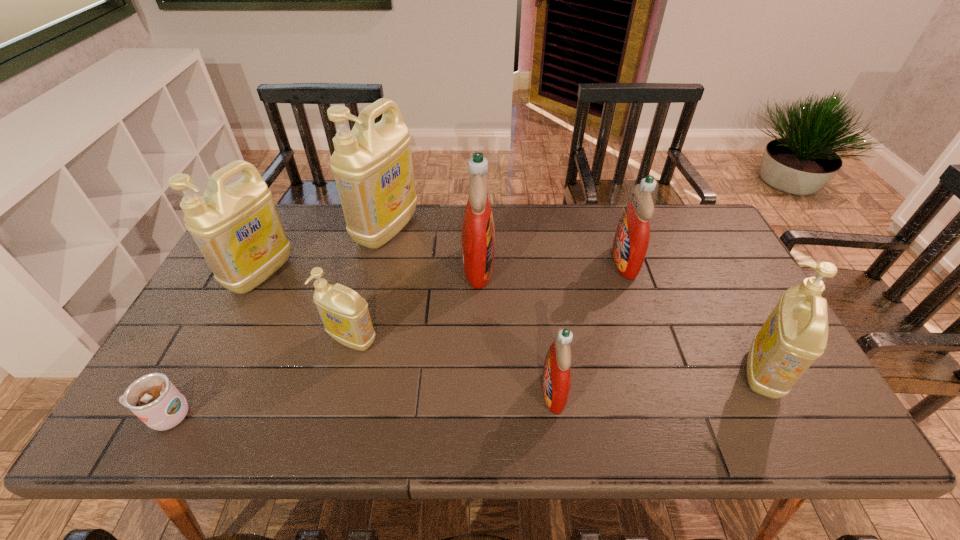
Find the location of a particular element. the smallest beige detergent is located at coordinates (345, 315).

This screenshot has width=960, height=540. I want to click on the third detergent from right to left, so click(x=556, y=382).

You are a GUI agent. You are given a task and a screenshot of the screen. Output one action in this format:
    pyautogui.click(x=<x>, y=<y>)
    Task: Click on the nearest red detergent
    
    Given the screenshot: What is the action you would take?
    pyautogui.click(x=556, y=382)

Image resolution: width=960 pixels, height=540 pixels. What are the coordinates of `the shortest object` in the screenshot? It's located at (153, 398).

Find the location of `vacant space located 0.250m on the right of the biggest beige detergent`. vacant space located 0.250m on the right of the biggest beige detergent is located at coordinates (493, 229).

The height and width of the screenshot is (540, 960). Find the location of `free space located 0.080m on the right of the leftmost beige detergent`. free space located 0.080m on the right of the leftmost beige detergent is located at coordinates (317, 273).

This screenshot has width=960, height=540. I want to click on vacant space positioned on the front surface of the fourth detergent from left to right, so click(600, 266).

Find the location of a particular element. free space located 0.160m on the front surface of the sixth detergent from left to right is located at coordinates (560, 262).

Where is `free space located on the front surface of the sixth detergent from left to right`? Image resolution: width=960 pixels, height=540 pixels. free space located on the front surface of the sixth detergent from left to right is located at coordinates (540, 262).

At what (x,y) coordinates should I click in order to perform the action: click on free spot located 0.360m on the front surface of the sixth detergent from left to right. Please return your answer as a coordinate pair (x, y). This screenshot has width=960, height=540. Looking at the image, I should click on pos(494,262).